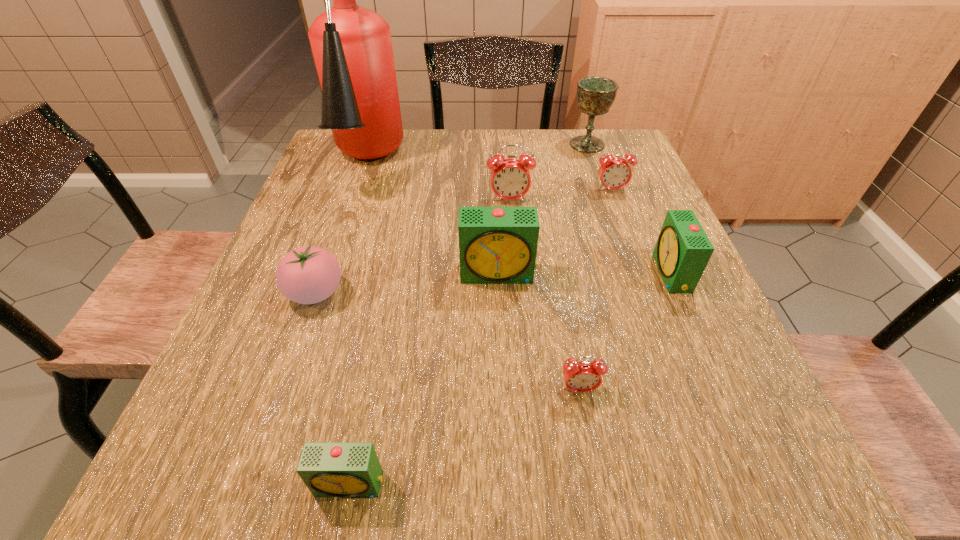
Identify the location of free space located 0.320m on the front-facing side of the rightmost green alarm clock. This screenshot has width=960, height=540. (501, 274).

Find the location of a particular element. vacant area located on the front-facing side of the rightmost green alarm clock is located at coordinates (501, 274).

I want to click on free spot located on the right of the red tomato, so click(x=433, y=293).

At what (x,y) coordinates should I click in order to perform the action: click on free space located 0.080m on the face of the smallest red alarm clock. Please return your answer as a coordinate pair (x, y). The image size is (960, 540). Looking at the image, I should click on (589, 446).

This screenshot has width=960, height=540. In order to click on fire extinguisher present at the far edge in this screenshot , I will do `click(352, 48)`.

At what (x,y) coordinates should I click in order to perform the action: click on chalice at the far edge. Please return your answer as a coordinate pair (x, y). Image resolution: width=960 pixels, height=540 pixels. Looking at the image, I should click on (595, 95).

Find the location of a particular element. object that is at the near edge is located at coordinates (329, 469).

Identify the location of fire extinguisher located at the left edge. (352, 48).

The width and height of the screenshot is (960, 540). I want to click on tomato that is at the left edge, so click(307, 275).

Find the location of a particular element. The height and width of the screenshot is (540, 960). chalice that is at the right edge is located at coordinates (595, 95).